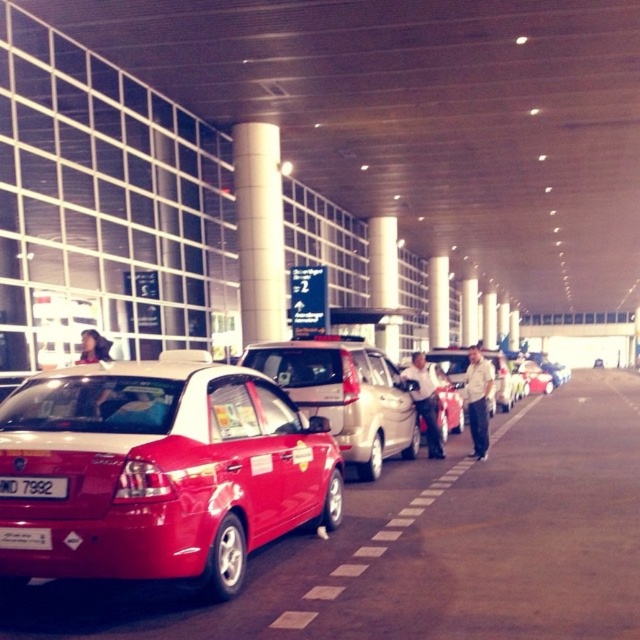
Question: Which point is farther to the camera?

Choices:
 (A) white plastic license plate at center
 (B) metallic silver suv at center

Answer: (B)

Question: Considering the real-world distances, which object is closest to the white plastic license plate at center?

Choices:
 (A) shiny red sedan at center
 (B) metallic silver suv at center

Answer: (A)

Question: Can you confirm if shiny red sedan at center is smaller than metallic silver suv at center?

Choices:
 (A) yes
 (B) no

Answer: (B)

Question: Observing the image, what is the correct spatial positioning of metallic silver suv at center in reference to white plastic license plate at center?

Choices:
 (A) below
 (B) above

Answer: (B)

Question: Which of the following is the closest to the observer?

Choices:
 (A) white plastic license plate at center
 (B) metallic silver suv at center
 (C) black plastic license plate at lower left
 (D) shiny red sedan at center

Answer: (D)

Question: Can you confirm if shiny red sedan at center is positioned to the left of metallic silver suv at center?

Choices:
 (A) yes
 (B) no

Answer: (A)